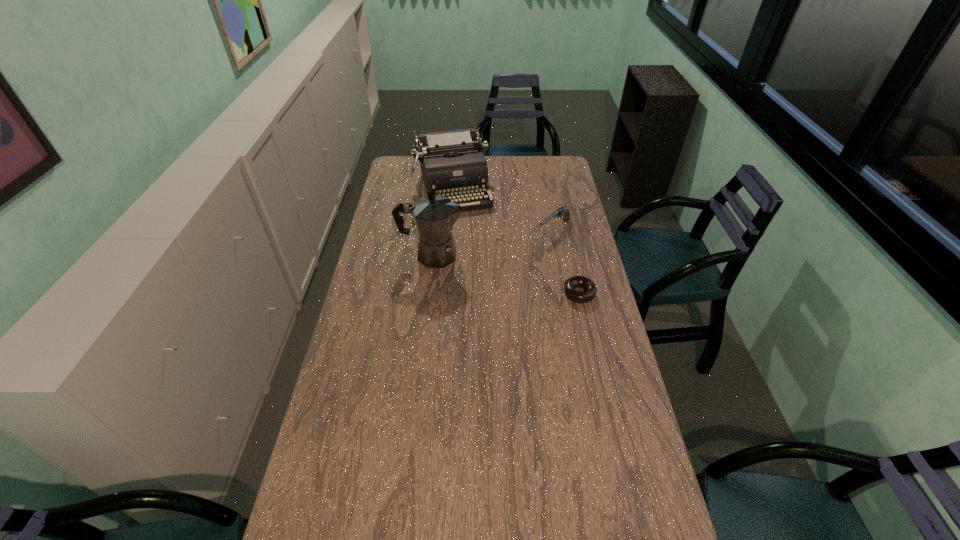
This screenshot has width=960, height=540. In order to click on free space between the third shortest object and the doughnut in this screenshot , I will do `click(516, 241)`.

Locate an element on the screen. The image size is (960, 540). vacant area that lies between the third tallest object and the coffeepot is located at coordinates (493, 242).

You are a GUI agent. You are given a task and a screenshot of the screen. Output one action in this format:
    pyautogui.click(x=<x>, y=<y>)
    Task: Click on the free spot between the third tallest object and the third farthest object
    
    Given the screenshot: What is the action you would take?
    pyautogui.click(x=493, y=242)

Where is `object that is the third closest to the gun`? object that is the third closest to the gun is located at coordinates (434, 216).

At what (x,y) coordinates should I click in order to perform the action: click on the second closest object to the coffeepot. Please return your answer as a coordinate pair (x, y). Looking at the image, I should click on 561,211.

The height and width of the screenshot is (540, 960). Identify the location of vacant point that satisfies the following two spatial constraints: 1. on the front side of the third tallest object; 2. on the left side of the third shortest object. (450, 228).

Locate an element on the screen. Image resolution: width=960 pixels, height=540 pixels. free space that satisfies the following two spatial constraints: 1. on the front side of the typewriter; 2. on the right side of the shortest object is located at coordinates pyautogui.click(x=444, y=293).